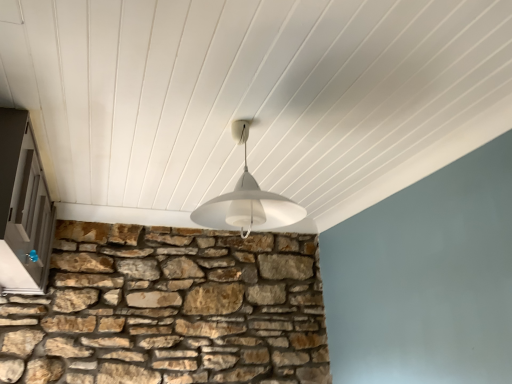
What do you see at coordinates (23, 208) in the screenshot? I see `matte gray door at left` at bounding box center [23, 208].

You are a GUI agent. You are given a task and a screenshot of the screen. Output one action in this format:
    pyautogui.click(x=<x>, y=<y>)
    Task: Click on the matte gray door at left
    
    Given the screenshot: What is the action you would take?
    pyautogui.click(x=23, y=208)

Describe the element at coordinates (247, 201) in the screenshot. The image size is (512, 384). I see `white matte lampshade at center` at that location.

The height and width of the screenshot is (384, 512). In order to click on white matte lampshade at center in this screenshot , I will do `click(247, 201)`.

Image resolution: width=512 pixels, height=384 pixels. I want to click on matte gray door at left, so click(x=23, y=208).

Which object is positioned more to the right, white matte lampshade at center or matte gray door at left?

From the viewer's perspective, white matte lampshade at center appears more on the right side.

Does white matte lampshade at center come in front of matte gray door at left?

No.

Which point is more forward, [222,220] or [49,218]?

The point [222,220] is closer to the camera.

From the image's perspective, which is above, white matte lampshade at center or matte gray door at left?

white matte lampshade at center is shown above in the image.

From a real-world perspective, which is physically above, white matte lampshade at center or matte gray door at left?

white matte lampshade at center, from a real-world perspective.

Which object is wider, white matte lampshade at center or matte gray door at left?

With larger width is white matte lampshade at center.

Is white matte lampshade at center taller or shorter than matte gray door at left?

Considering their sizes, white matte lampshade at center has less height than matte gray door at left.

Is white matte lampshade at center bigger than matte gray door at left?

Actually, white matte lampshade at center might be smaller than matte gray door at left.

Is white matte lampshade at center spatially inside matte gray door at left, or outside of it?

white matte lampshade at center cannot be found inside matte gray door at left.

Is white matte lampshade at center not near matte gray door at left?

No, white matte lampshade at center is in close proximity to matte gray door at left.

Could you tell me if white matte lampshade at center is facing matte gray door at left?

No, white matte lampshade at center is not facing towards matte gray door at left.

Find the location of a particular element. The height and width of the screenshot is (384, 512). window in front of the white matte lampshade at center is located at coordinates (23, 208).

Between matte gray door at left and white matte lampshade at center, which one appears on the right side from the viewer's perspective?

white matte lampshade at center is more to the right.

Considering their positions, is matte gray door at left located in front of or behind white matte lampshade at center?

matte gray door at left is positioned closer to the viewer than white matte lampshade at center.

Which is in front, point (37, 225) or point (243, 225)?

The point (243, 225) is closer.

From the image's perspective, is matte gray door at left on white matte lampshade at center?

Actually, matte gray door at left appears below white matte lampshade at center in the image.

From a real-world perspective, between matte gray door at left and white matte lampshade at center, who is vertically higher?

From a 3D spatial view, white matte lampshade at center is above.

Does matte gray door at left have a greater width compared to white matte lampshade at center?

In fact, matte gray door at left might be narrower than white matte lampshade at center.

Between matte gray door at left and white matte lampshade at center, which one has more height?

With more height is matte gray door at left.

Considering the relative sizes of matte gray door at left and white matte lampshade at center in the image provided, is matte gray door at left smaller than white matte lampshade at center?

No, matte gray door at left is not smaller than white matte lampshade at center.

Is matte gray door at left not inside white matte lampshade at center?

Yes, matte gray door at left is located beyond the bounds of white matte lampshade at center.

Is matte gray door at left touching white matte lampshade at center?

No, matte gray door at left is not beside white matte lampshade at center.

Is matte gray door at left facing towards white matte lampshade at center?

Yes, matte gray door at left is oriented towards white matte lampshade at center.

Identify the location of window directly beneath the white matte lampshade at center (from a real-world perspective). (23, 208).

Image resolution: width=512 pixels, height=384 pixels. Identify the location of window below the white matte lampshade at center (from the image's perspective). (23, 208).

Image resolution: width=512 pixels, height=384 pixels. Identify the location of lamp that appears behind the matte gray door at left. (247, 201).